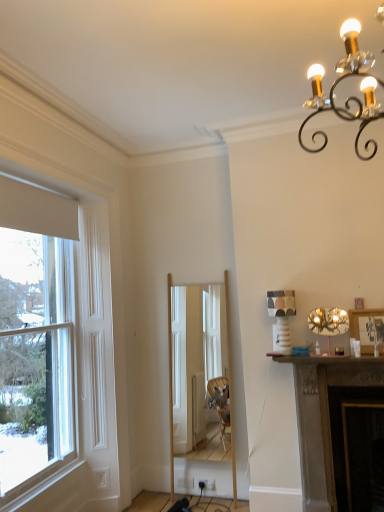
Question: Considering the positions of dark brown stone fireplace at lower right and wooden framed picture at right in the image, is dark brown stone fireplace at lower right taller or shorter than wooden framed picture at right?

Choices:
 (A) tall
 (B) short

Answer: (A)

Question: In the image, is dark brown stone fireplace at lower right on the left side or the right side of wooden framed picture at right?

Choices:
 (A) left
 (B) right

Answer: (A)

Question: Which object is the closest to the metallic gold chandelier at upper right?

Choices:
 (A) wooden framed picture at right
 (B) white wood window at left
 (C) metallic gold chandelier at upper right
 (D) dark brown stone fireplace at lower right
 (E) natural wood mirror at center

Answer: (A)

Question: Which object is positioned closest to the metallic gold chandelier at upper right?

Choices:
 (A) wooden framed picture at right
 (B) white wood window at left
 (C) dark brown stone fireplace at lower right
 (D) natural wood mirror at center
 (E) metallic gold chandelier at upper right

Answer: (A)